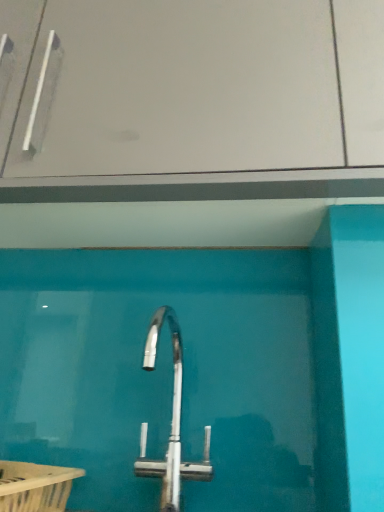
Question: Could transparent glass door at center be considered to be inside polished chrome tap at center?

Choices:
 (A) no
 (B) yes

Answer: (A)

Question: Is polished chrome tap at center not inside transparent glass door at center?

Choices:
 (A) no
 (B) yes

Answer: (B)

Question: Is polished chrome tap at center smaller than transparent glass door at center?

Choices:
 (A) yes
 (B) no

Answer: (A)

Question: From the image's perspective, is polished chrome tap at center under transparent glass door at center?

Choices:
 (A) no
 (B) yes

Answer: (B)

Question: From a real-world perspective, does polished chrome tap at center sit lower than transparent glass door at center?

Choices:
 (A) no
 (B) yes

Answer: (B)

Question: Is polished chrome tap at center positioned behind transparent glass door at center?

Choices:
 (A) yes
 (B) no

Answer: (B)

Question: From a real-world perspective, is polished chrome tap at center physically above white plastic bath at lower left?

Choices:
 (A) yes
 (B) no

Answer: (A)

Question: Is polished chrome tap at center smaller than white plastic bath at lower left?

Choices:
 (A) yes
 (B) no

Answer: (B)

Question: Is polished chrome tap at center completely or partially outside of white plastic bath at lower left?

Choices:
 (A) no
 (B) yes

Answer: (B)

Question: Is white plastic bath at lower left at the back of polished chrome tap at center?

Choices:
 (A) yes
 (B) no

Answer: (B)

Question: Is polished chrome tap at center next to white plastic bath at lower left and touching it?

Choices:
 (A) yes
 (B) no

Answer: (B)

Question: Can you confirm if polished chrome tap at center is taller than white plastic bath at lower left?

Choices:
 (A) yes
 (B) no

Answer: (A)

Question: Can you confirm if white plastic bath at lower left is smaller than polished chrome tap at center?

Choices:
 (A) no
 (B) yes

Answer: (B)